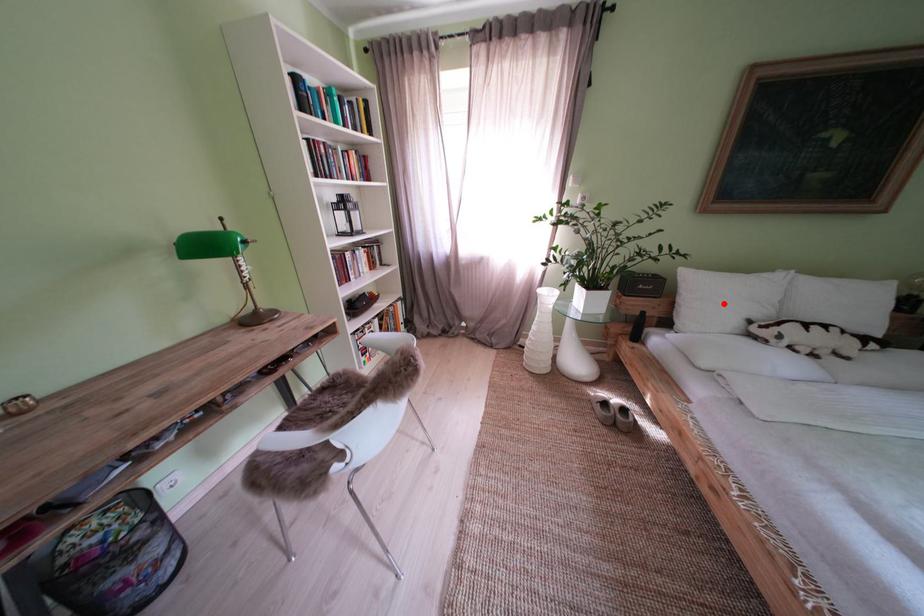
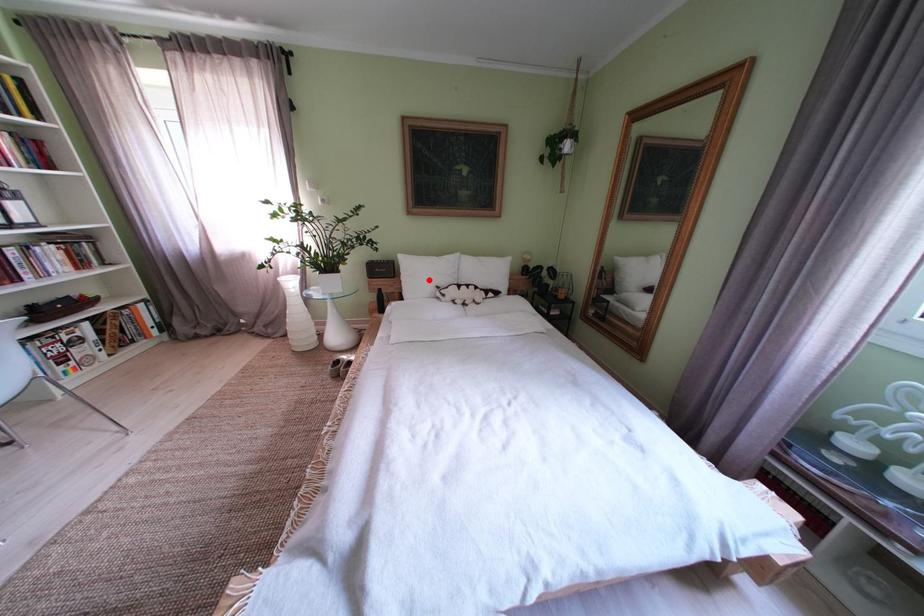
I am providing you with two images of the same scene from different viewpoints. A red point is marked on the first image and another point is marked on the second image. Do the highlighted points in image1 and image2 indicate the same real-world spot?

Yes